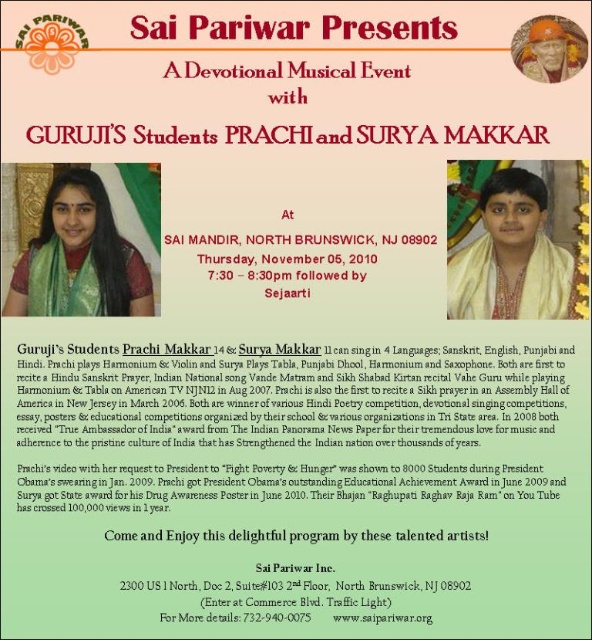
Question: Where is green silk saree at center located in relation to matte gold helmet at upper right in the image?

Choices:
 (A) above
 (B) below

Answer: (B)

Question: Based on their relative distances, which object is farther from the white silk shawl at upper right?

Choices:
 (A) matte gold helmet at upper right
 (B) green silk saree at center
 (C) white paper at center
 (D) green fabric at upper left

Answer: (B)

Question: Which point appears farthest from the camera in this image?

Choices:
 (A) (452, 260)
 (B) (243, 481)

Answer: (A)

Question: In this image, where is green fabric at upper left located relative to matte gold helmet at upper right?

Choices:
 (A) below
 (B) above

Answer: (A)

Question: Which of the following is the closest to the observer?

Choices:
 (A) white paper at center
 (B) green fabric at upper left
 (C) green silk saree at center

Answer: (B)

Question: Is green fabric at upper left smaller than white silk shawl at upper right?

Choices:
 (A) yes
 (B) no

Answer: (B)